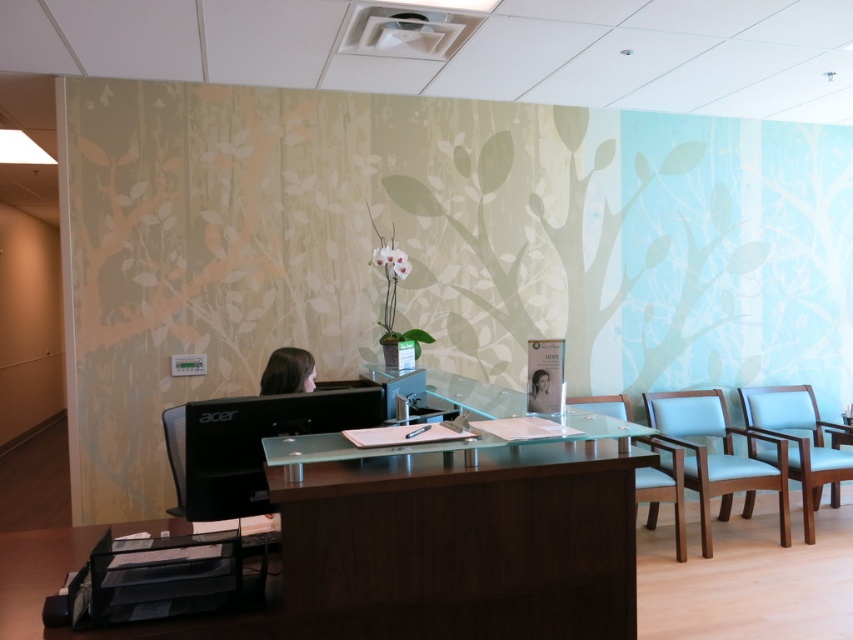
Is point (61, 540) positioned behind point (635, 477)?

No, (61, 540) is in front of (635, 477).

Between point (1, 556) and point (643, 490), which one is positioned in front?

Point (1, 556) is more forward.

Who is more distant from viewer, (0, 548) or (657, 484)?

Point (657, 484)

Locate an element on the screen. The height and width of the screenshot is (640, 853). black plastic file organizer at lower left is located at coordinates (36, 573).

Who is shorter, dark brown wood table at center or light blue fabric chair at center?

Standing shorter between the two is dark brown wood table at center.

The image size is (853, 640). What do you see at coordinates (462, 545) in the screenshot?
I see `dark brown wood table at center` at bounding box center [462, 545].

Locate an element on the screen. The height and width of the screenshot is (640, 853). dark brown wood table at center is located at coordinates (462, 545).

Who is more distant from viewer, (33, 593) or (264, 390)?

Positioned behind is point (264, 390).

Is point (180, 529) behind point (273, 380)?

No.

Who is more forward, (21, 600) or (265, 380)?

Positioned in front is point (21, 600).

I want to click on black plastic file organizer at lower left, so click(36, 573).